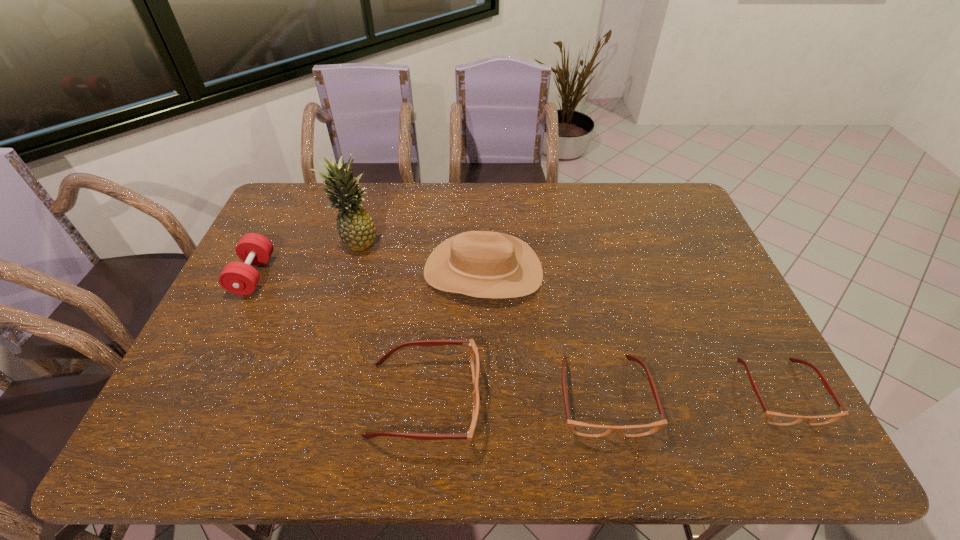
Where is `vacant area that lies between the fifth object from right to left and the second tallest object`? The width and height of the screenshot is (960, 540). vacant area that lies between the fifth object from right to left and the second tallest object is located at coordinates (420, 256).

At what (x,y) coordinates should I click in order to perform the action: click on vacant space in between the cowboy hat and the rightmost spectacles. Please return your answer as a coordinate pair (x, y). Looking at the image, I should click on (632, 332).

Identify which object is the second closest to the leftmost spectacles. Please provide its 2D coordinates. Your answer should be formatted as a tuple, i.e. [(x, y)], where the tuple contains the x and y coordinates of a point satisfying the conditions above.

[(579, 428)]

Choose which object is the fifth nearest neighbor to the leftmost object. Please provide its 2D coordinates. Your answer should be formatted as a tuple, i.e. [(x, y)], where the tuple contains the x and y coordinates of a point satisfying the conditions above.

[(774, 418)]

Locate which spectacles ranks second in proximity to the leftmost spectacles. Please provide its 2D coordinates. Your answer should be formatted as a tuple, i.e. [(x, y)], where the tuple contains the x and y coordinates of a point satisfying the conditions above.

[(774, 418)]

Identify the location of spectacles identified as the third closest to the second object from left to right. (774, 418).

Identify the location of blank space that satisfies the following two spatial constraints: 1. on the back side of the dumbbell; 2. on the right side of the second object from left to right. (271, 241).

This screenshot has width=960, height=540. What are the coordinates of `vacant position in the image that satisfies the following two spatial constraints: 1. on the front side of the cowboy hat; 2. on the front-facing side of the leftmost spectacles` in the screenshot? It's located at (484, 400).

Find the location of a particular element. The width and height of the screenshot is (960, 540). vacant space that satisfies the following two spatial constraints: 1. on the front-facing side of the rightmost spectacles; 2. on the front-facing side of the leftmost spectacles is located at coordinates (784, 400).

This screenshot has width=960, height=540. I want to click on vacant space that satisfies the following two spatial constraints: 1. on the back side of the leftmost object; 2. on the right side of the pineapple, so pyautogui.click(x=271, y=241).